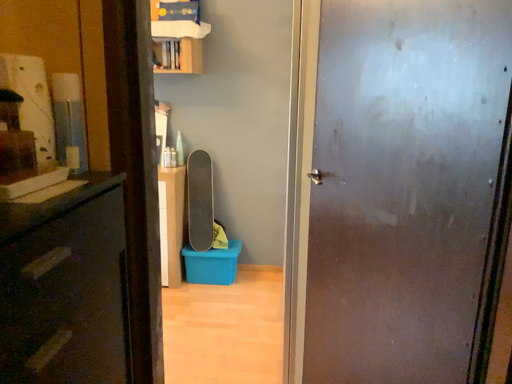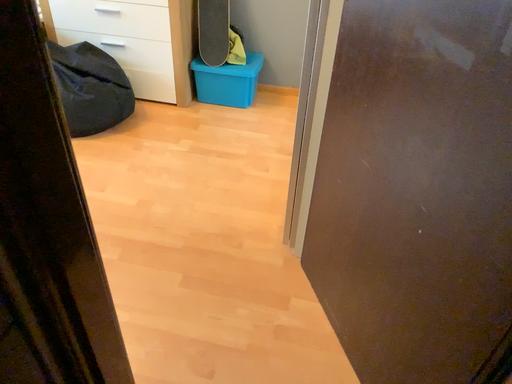
Question: How did the camera likely rotate when shooting the video?

Choices:
 (A) rotated left
 (B) rotated right

Answer: (A)